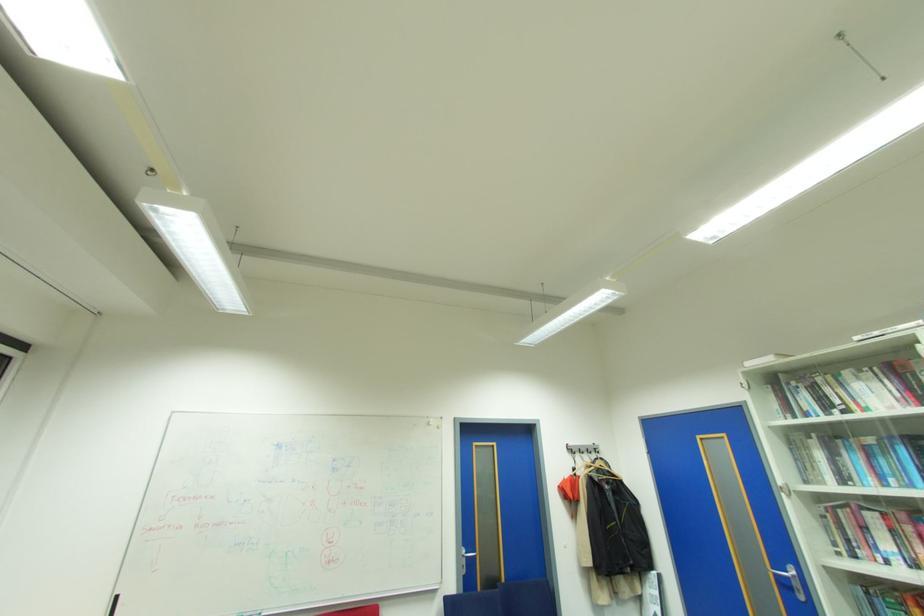
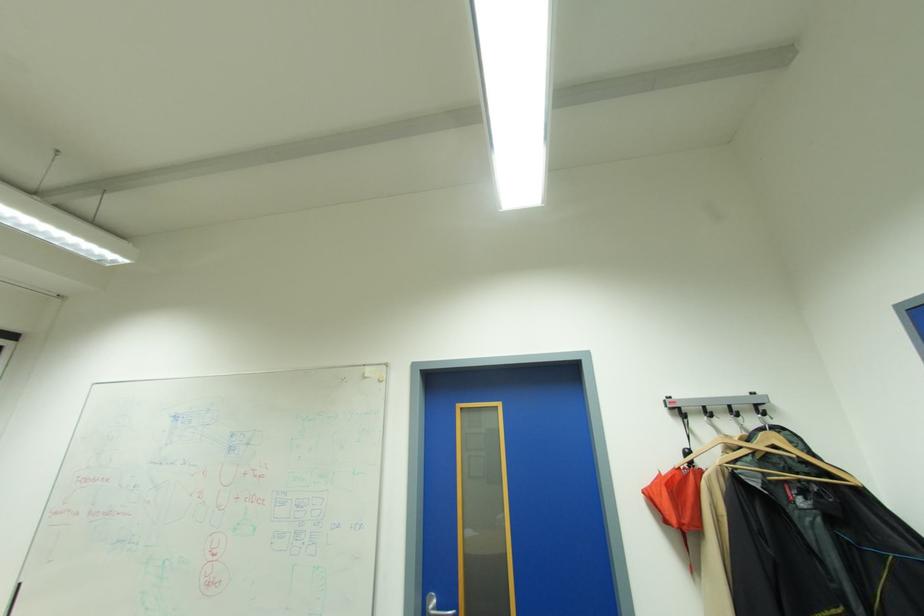
Where in the second image is the point corresponding to (592,451) from the first image?

(738, 410)